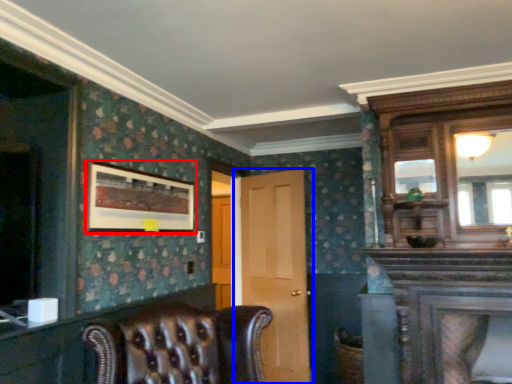
Question: Which object appears closest to the camera in this image, picture frame (highlighted by a red box) or door (highlighted by a blue box)?

Choices:
 (A) picture frame
 (B) door

Answer: (A)